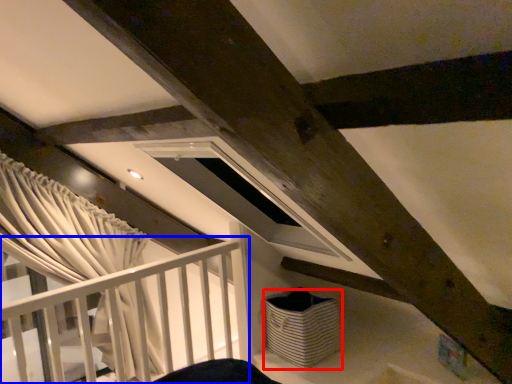
Question: Which object appears closest to the camera in this image, basket (highlighted by a red box) or rail (highlighted by a blue box)?

Choices:
 (A) basket
 (B) rail

Answer: (B)